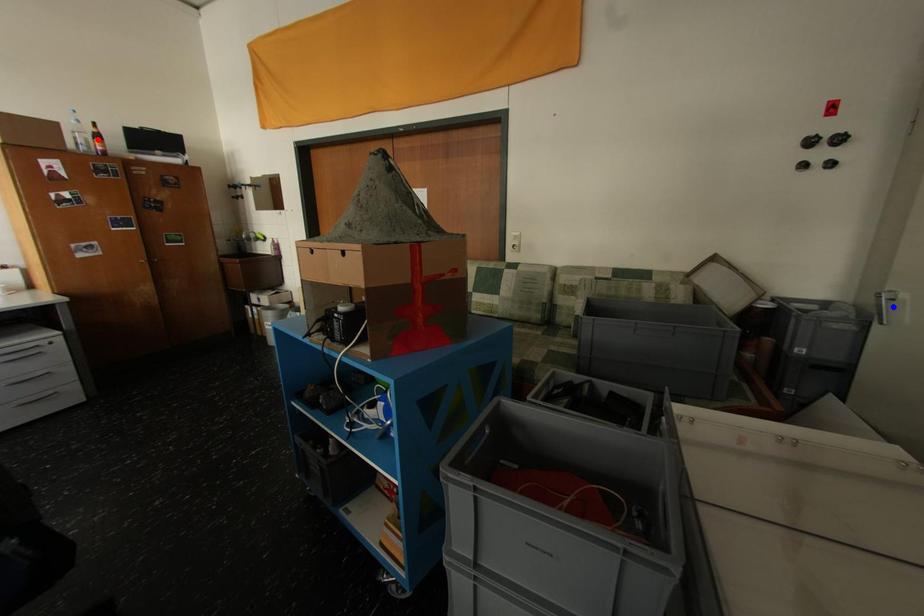
Question: In the image, two points are highlighted. Which point is nearer to the camera? Reply with the corresponding letter.

Choices:
 (A) blue point
 (B) red point

Answer: (A)